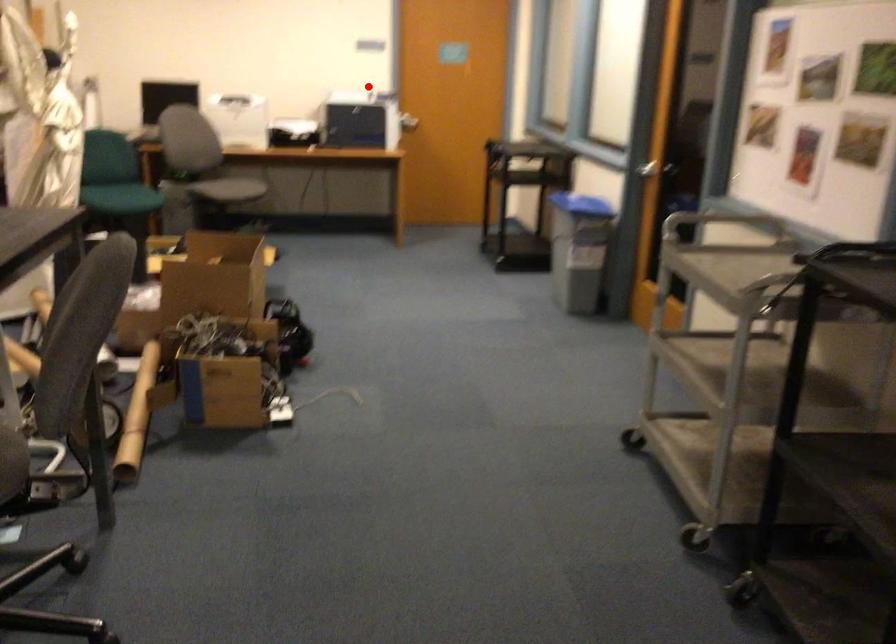
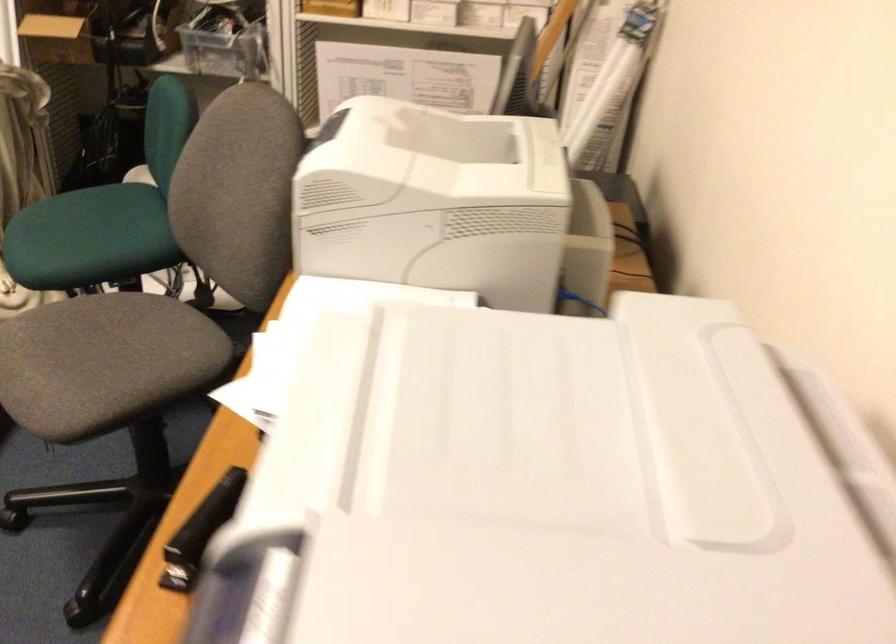
Question: A red point is marked in image1. In image2, is the corresponding 3D point closer to the camera or farther? Reply with the corresponding letter.

Choices:
 (A) The corresponding 3D point is closer.
 (B) The corresponding 3D point is farther.

Answer: (A)